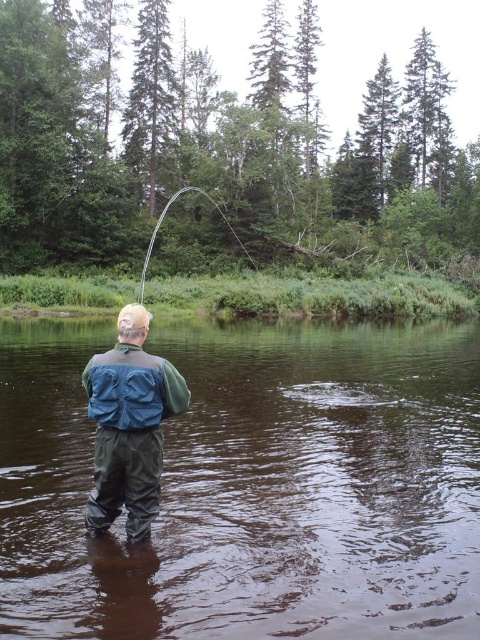
Question: Can you confirm if green waterproof suit at center is wider than blue waterproof jacket at back?

Choices:
 (A) yes
 (B) no

Answer: (B)

Question: Is brown rubber boots at lower center below green waterproof suit at center?

Choices:
 (A) no
 (B) yes

Answer: (B)

Question: Which of these objects is positioned closest to the shiny silver rod at center?

Choices:
 (A) blue waterproof jacket at back
 (B) brown rubber boots at lower center

Answer: (B)

Question: Which object is the farthest from the blue waterproof jacket at back?

Choices:
 (A) brown rubber boots at lower center
 (B) shiny silver rod at center
 (C) green waterproof suit at center

Answer: (B)

Question: Is brown rubber boots at lower center positioned at the back of green waterproof suit at center?

Choices:
 (A) yes
 (B) no

Answer: (B)

Question: Which of the following is the closest to the observer?

Choices:
 (A) green waterproof suit at center
 (B) brown rubber boots at lower center
 (C) shiny silver rod at center

Answer: (B)